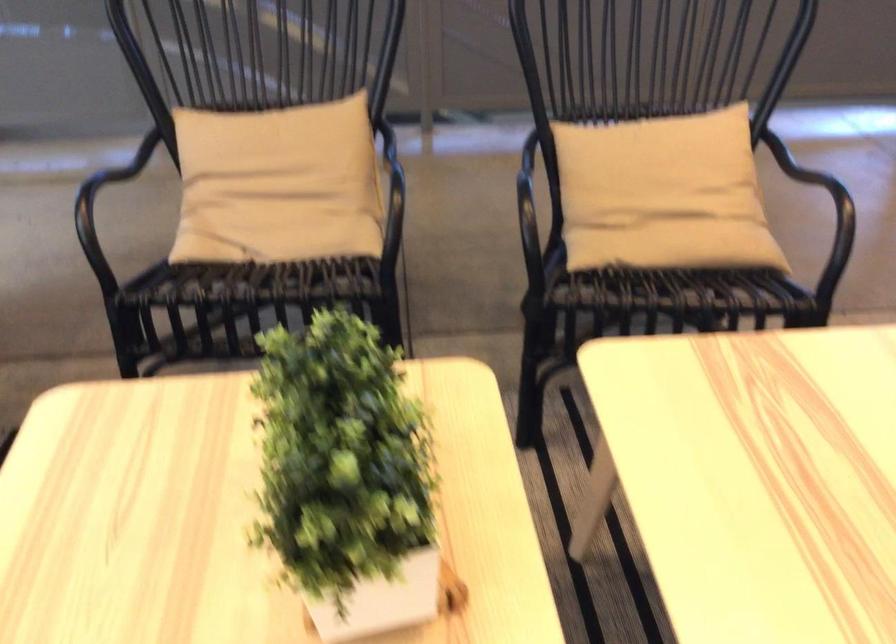
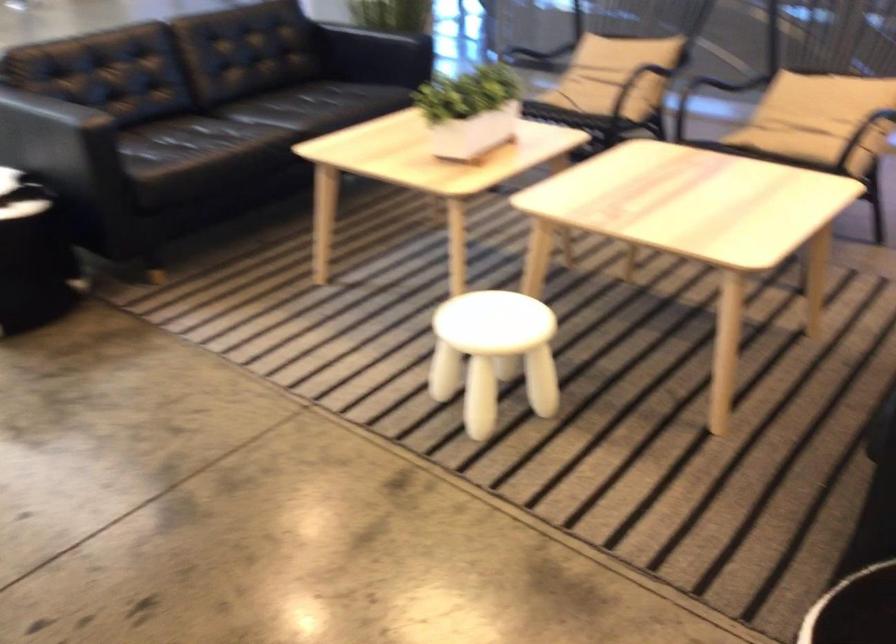
Where in the second image is the point corresponding to point 725,214 from the first image?

(817, 118)